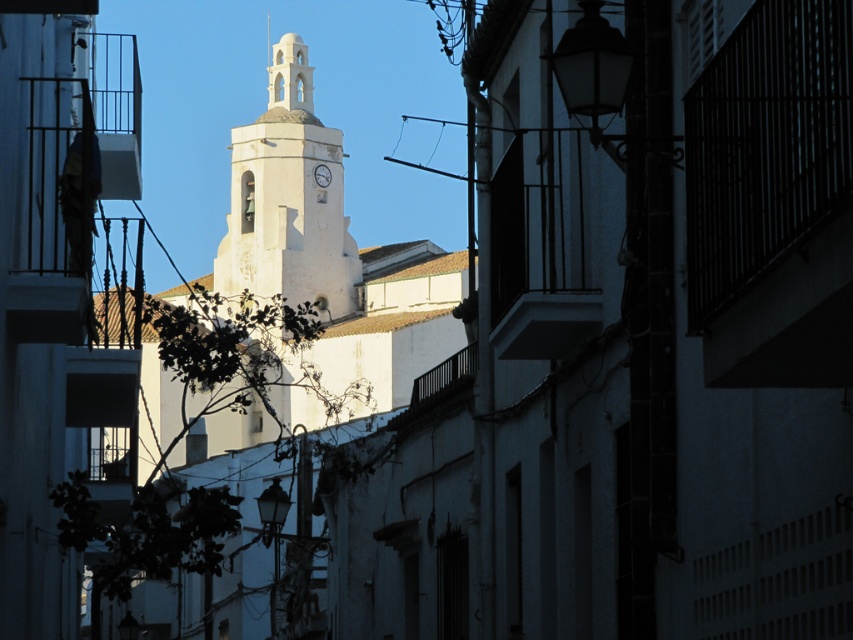
Question: Is the position of white stucco bell tower at center more distant than that of white glossy clock at center?

Choices:
 (A) no
 (B) yes

Answer: (A)

Question: Is white stucco bell tower at center behind white glossy clock at center?

Choices:
 (A) yes
 (B) no

Answer: (B)

Question: Which point is farther to the camera?

Choices:
 (A) white stucco bell tower at center
 (B) white glossy clock at center

Answer: (B)

Question: Can you confirm if white stucco bell tower at center is wider than white glossy clock at center?

Choices:
 (A) yes
 (B) no

Answer: (A)